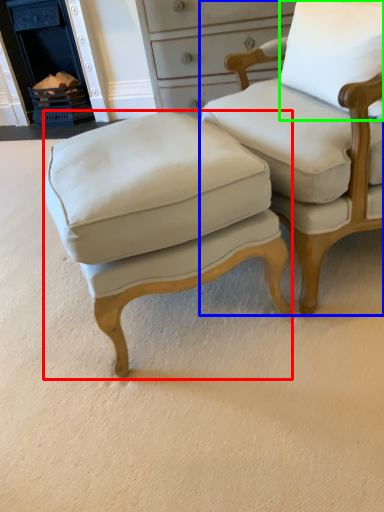
Question: Considering the real-world distances, which object is farthest from stool (highlighted by a red box)? chair (highlighted by a blue box) or pillow (highlighted by a green box)?

Choices:
 (A) chair
 (B) pillow

Answer: (B)